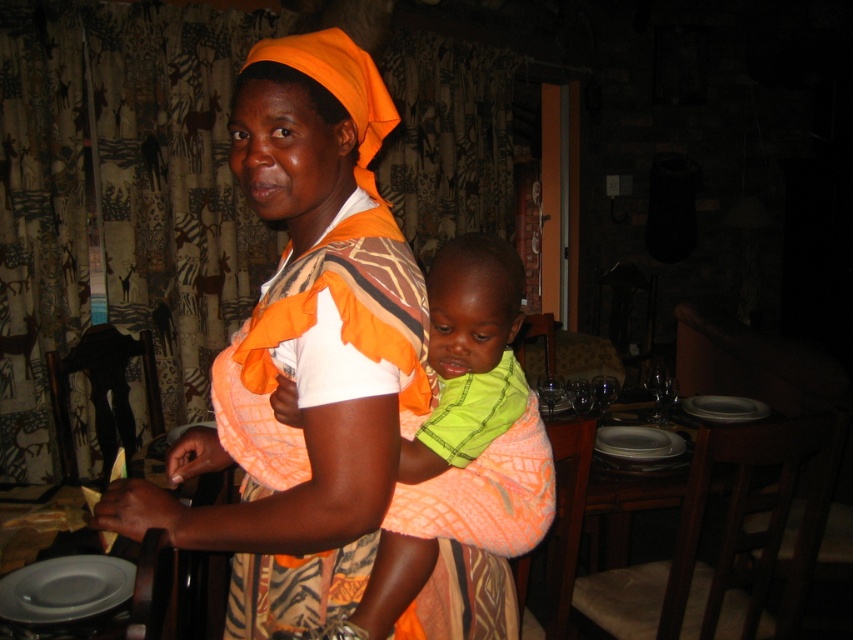
In the scene shown: You are a guest at a dinner party and see the matte gray platter at lower left and the white glossy plate at center. Which object is positioned lower in the image?

The matte gray platter at lower left is positioned lower than the white glossy plate at center.

You are a photographer trying to capture a detailed shot of both the neon green fabric at center and the white glossy plate at center. Since you can only focus on one object at a time, which object should you focus on first to ensure it appears sharp in the photo?

You should focus on the neon green fabric at center first because it is closer to the viewer than the white glossy plate at center, so adjusting focus from near to far will help both objects appear sharp.

You are a guest at a dinner party and see the neon green fabric at center and the white glossy plate at center on the table. Which object is positioned higher relative to the other?

The neon green fabric at center is above the white glossy plate at center.